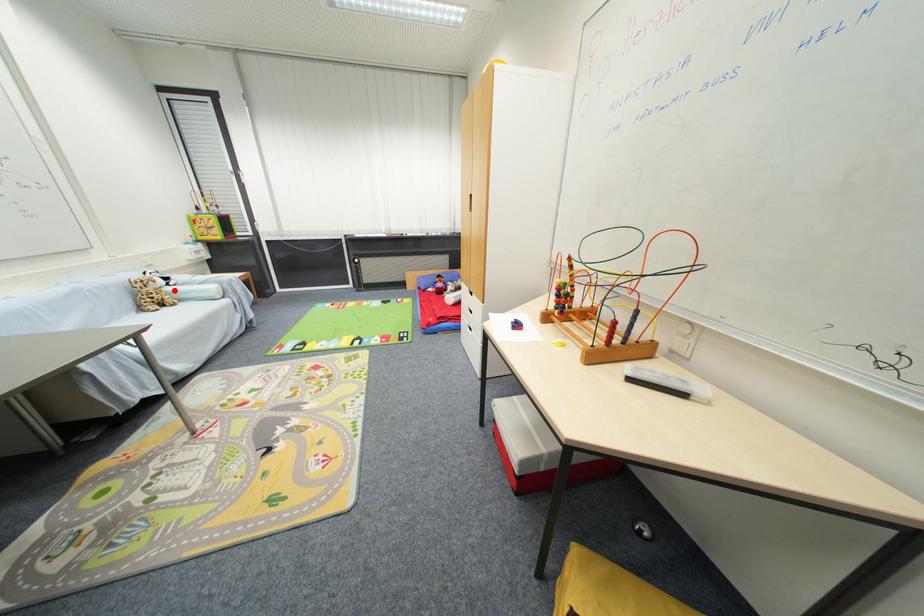
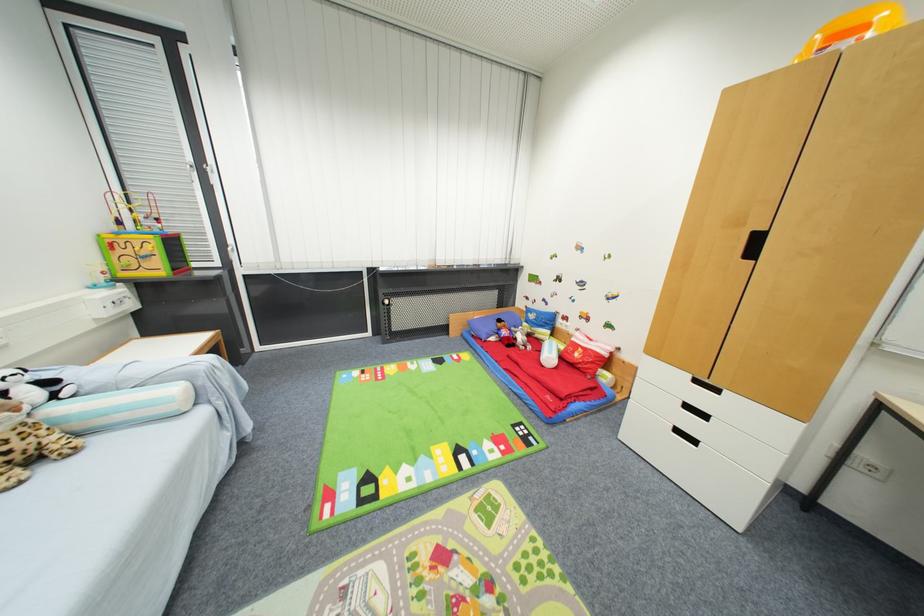
The point at the highlighted location is marked in the first image. Where is the corresponding point in the second image?

(64, 411)